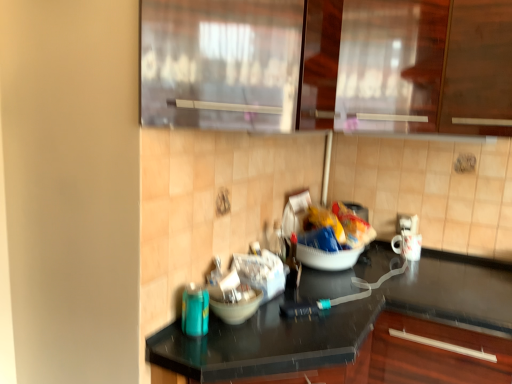
Question: Would you say transparent glass door at upper center, acting as the second glass door starting from the back, is part of black glossy countertop at center's contents?

Choices:
 (A) no
 (B) yes

Answer: (A)

Question: Is black glossy countertop at center closer to the viewer compared to transparent glass door at upper center, the first glass door viewed from the front?

Choices:
 (A) yes
 (B) no

Answer: (A)

Question: From the image's perspective, does black glossy countertop at center appear higher than transparent glass door at upper center, acting as the second glass door starting from the back?

Choices:
 (A) yes
 (B) no

Answer: (B)

Question: Could you tell me if black glossy countertop at center is turned towards transparent glass door at upper center, the first glass door viewed from the front?

Choices:
 (A) yes
 (B) no

Answer: (B)

Question: Can you confirm if black glossy countertop at center is positioned to the right of transparent glass door at upper center, the first glass door viewed from the front?

Choices:
 (A) no
 (B) yes

Answer: (B)

Question: Considering the relative positions of black glossy countertop at center and white glossy mug at right in the image provided, is black glossy countertop at center to the left or to the right of white glossy mug at right?

Choices:
 (A) left
 (B) right

Answer: (A)

Question: From a real-world perspective, relative to white glossy mug at right, is black glossy countertop at center vertically above or below?

Choices:
 (A) above
 (B) below

Answer: (B)

Question: Is point (415, 329) positioned closer to the camera than point (417, 223)?

Choices:
 (A) farther
 (B) closer

Answer: (B)

Question: Looking at the image, does black glossy countertop at center seem bigger or smaller compared to white glossy mug at right?

Choices:
 (A) big
 (B) small

Answer: (A)

Question: Is point tap(181, 119) closer or farther from the camera than point tap(244, 309)?

Choices:
 (A) farther
 (B) closer

Answer: (B)

Question: Based on their sizes in the image, would you say transparent glass door at upper center, acting as the second glass door starting from the back, is bigger or smaller than matte white bowl at center?

Choices:
 (A) small
 (B) big

Answer: (B)

Question: Considering the positions of transparent glass door at upper center, acting as the second glass door starting from the back, and matte white bowl at center in the image, is transparent glass door at upper center, acting as the second glass door starting from the back, taller or shorter than matte white bowl at center?

Choices:
 (A) short
 (B) tall

Answer: (B)

Question: Is transparent glass door at upper center, acting as the second glass door starting from the back, in front of or behind matte white bowl at center in the image?

Choices:
 (A) front
 (B) behind

Answer: (A)

Question: Does point (406, 122) appear closer or farther from the camera than point (314, 226)?

Choices:
 (A) farther
 (B) closer

Answer: (B)

Question: From a real-world perspective, is transparent glass cabinet at upper center, the first glass door when ordered from back to front, above or below yellow crinkled chips at center?

Choices:
 (A) below
 (B) above

Answer: (B)